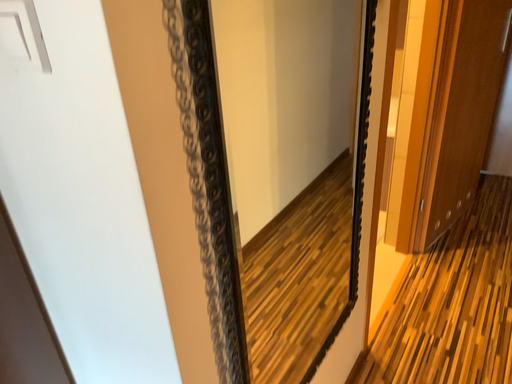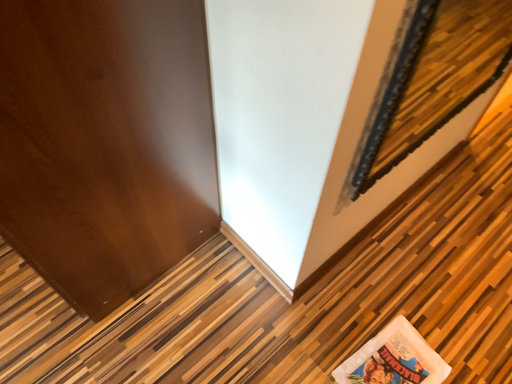
Question: Which way did the camera rotate in the video?

Choices:
 (A) rotated downward
 (B) rotated upward

Answer: (A)